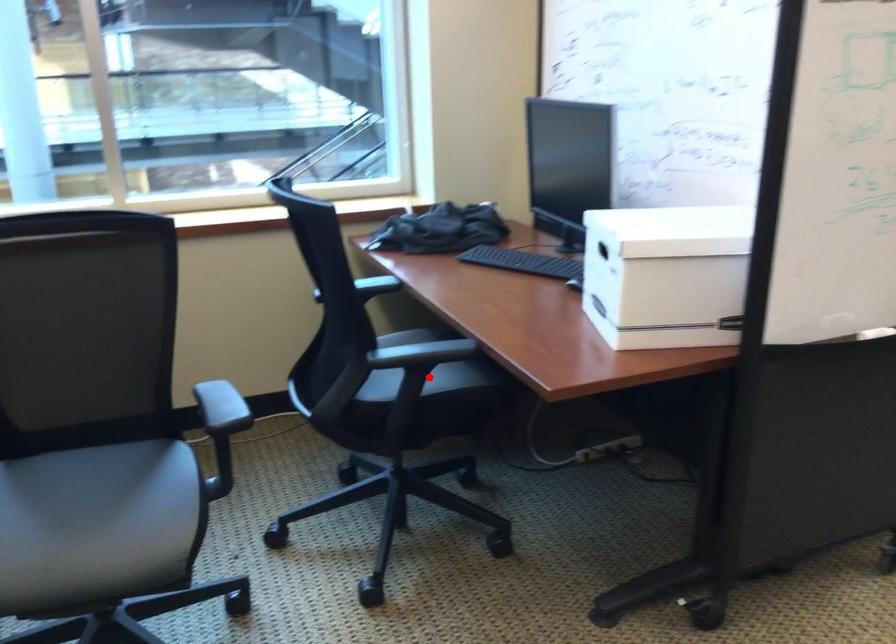
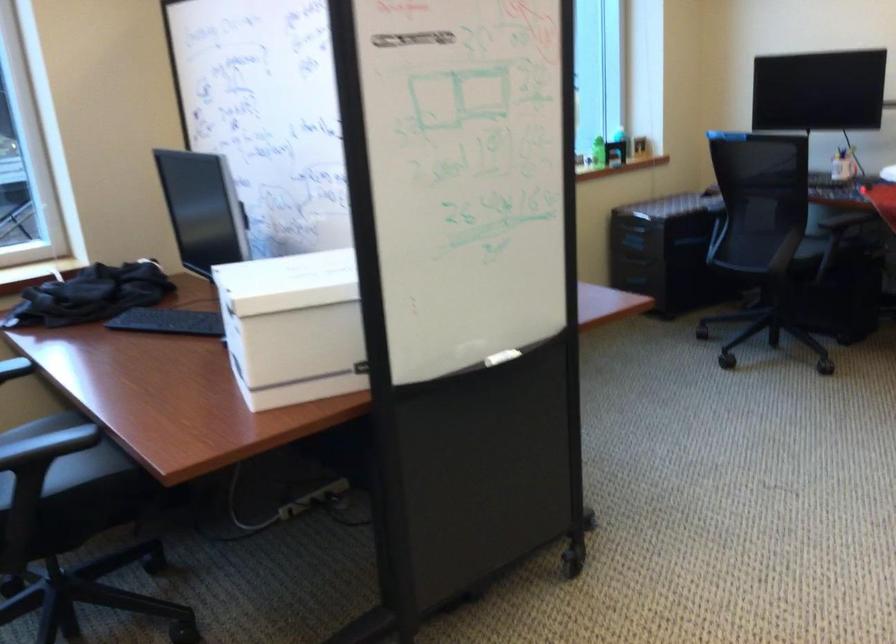
Question: I am providing you with two images of the same scene from different viewpoints. Image1 has a red point marked. In image2, the corresponding 3D location appears at what relative position? Reply with the corresponding letter.

Choices:
 (A) Closer
 (B) Farther

Answer: (A)